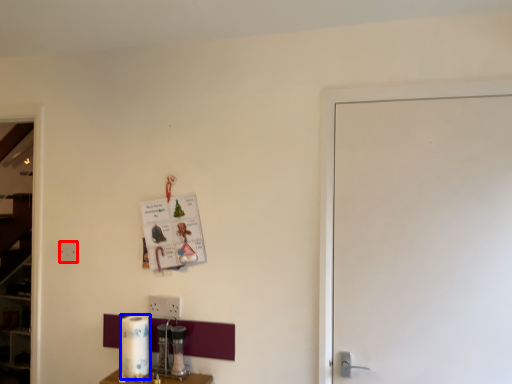
Question: Which object appears closest to the camera in this image, electric outlet (highlighted by a red box) or paper towel (highlighted by a blue box)?

Choices:
 (A) electric outlet
 (B) paper towel

Answer: (B)